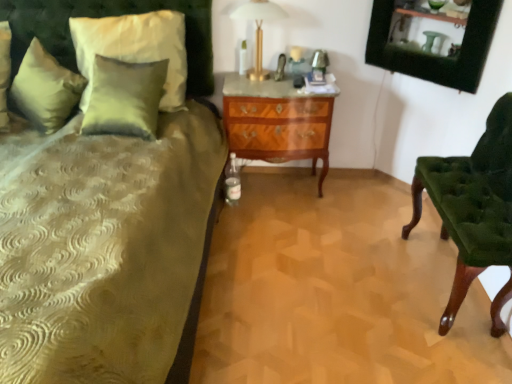
Find the location of a particular element. This screenshot has height=384, width=512. free region under gold metallic table lamp at upper center (from a real-world perspective) is located at coordinates (254, 76).